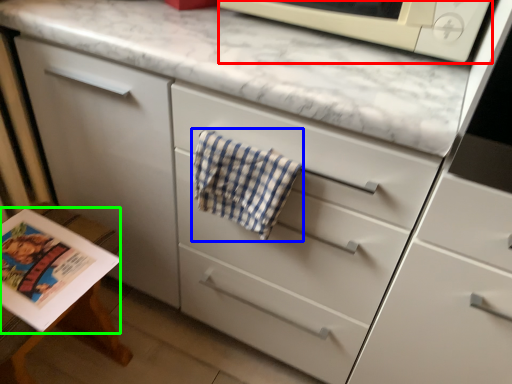
Question: Based on their relative distances, which object is farther from microwave oven (highlighted by a red box)? Choose from beach towel (highlighted by a blue box) and magazine (highlighted by a green box).

Choices:
 (A) beach towel
 (B) magazine

Answer: (B)